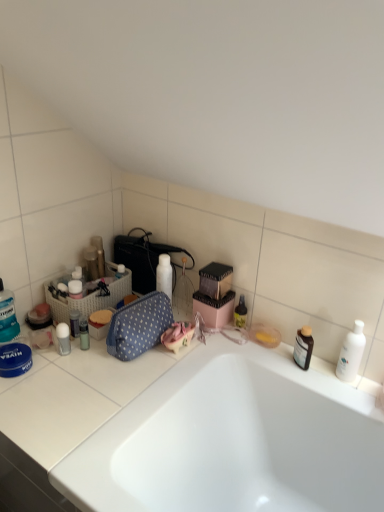
Where is `free location in front of brown glass bottle at right, the 2th toiletry when ordered from right to left`? This screenshot has width=384, height=512. free location in front of brown glass bottle at right, the 2th toiletry when ordered from right to left is located at coordinates (321, 389).